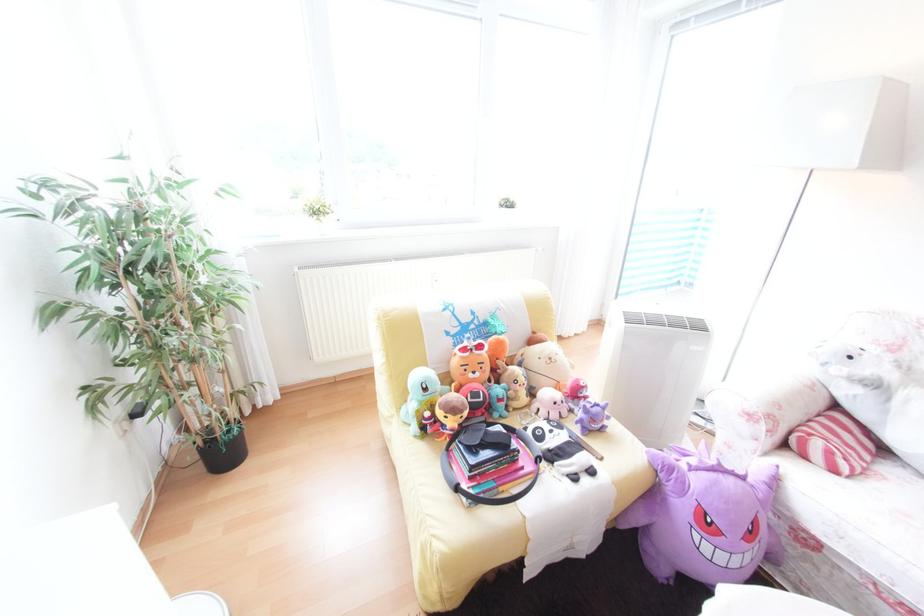
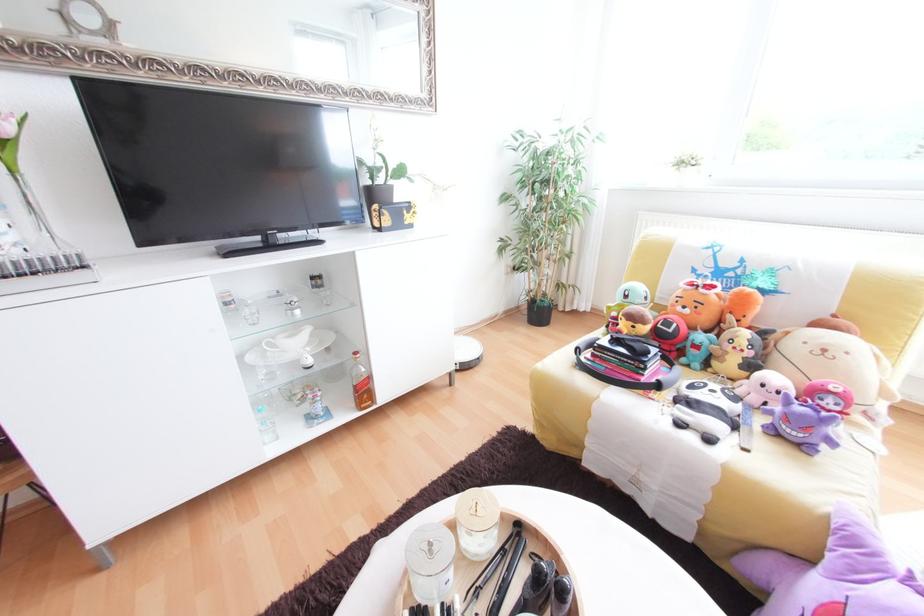
The point at [600,472] is marked in the first image. Where is the corresponding point in the second image?

(718, 440)